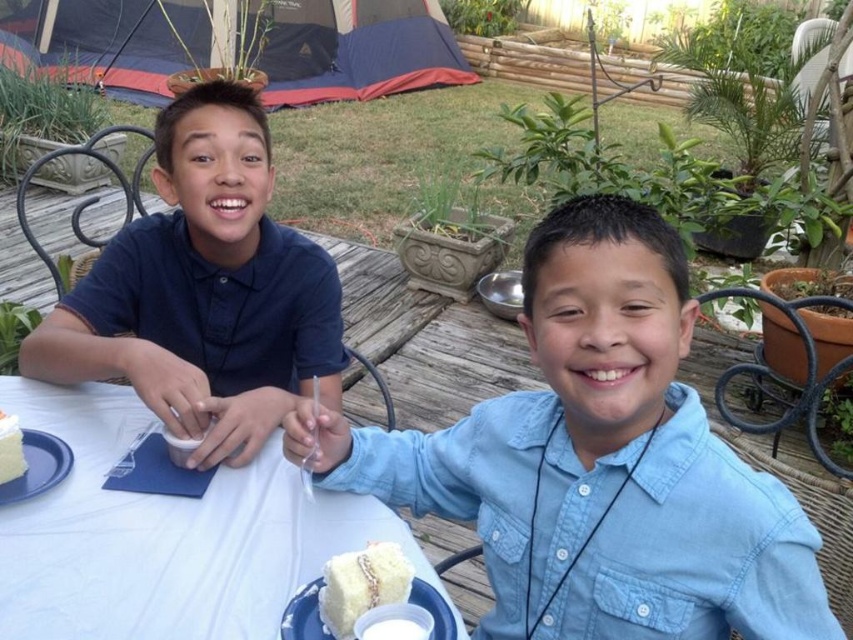
Question: Which of the following is the closest to the observer?

Choices:
 (A) coord(146,509)
 (B) coord(447,634)

Answer: (B)

Question: Which of the following is the farthest from the observer?

Choices:
 (A) white matte cake at lower left
 (B) white fluffy cake at lower center
 (C) white fluffy cake at lower left

Answer: (C)

Question: Is white cloth table at center in front of white matte plate at lower center?

Choices:
 (A) yes
 (B) no

Answer: (A)

Question: Is white fluffy cake at lower center below white fluffy cake at lower left?

Choices:
 (A) no
 (B) yes

Answer: (B)

Question: Which object appears closest to the camera in this image?

Choices:
 (A) white cloth table at center
 (B) matte blue shirt at left

Answer: (A)

Question: Can you confirm if matte blue shirt at left is smaller than white cloth table at center?

Choices:
 (A) yes
 (B) no

Answer: (B)